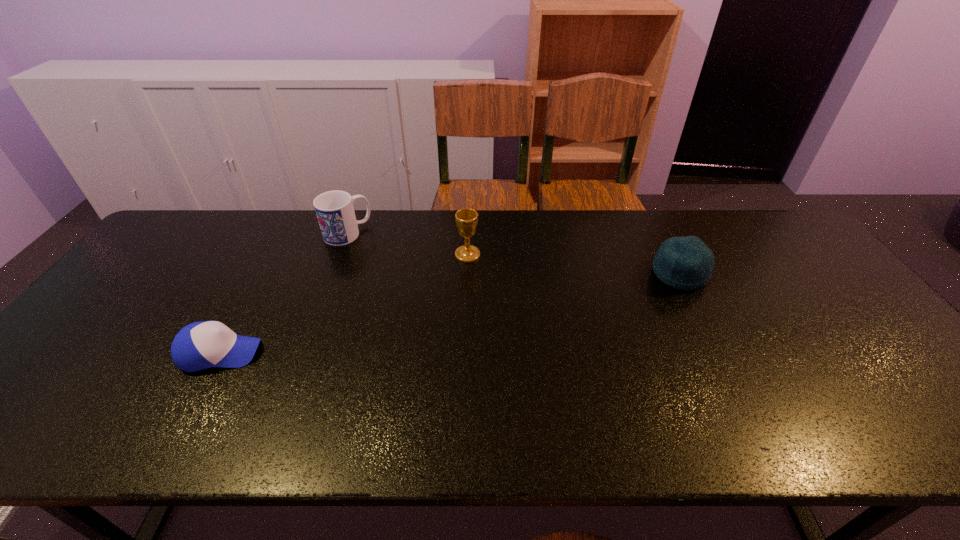
At what (x,y) coordinates should I click in order to perform the action: click on chalice located in the far edge section of the desktop. Please return your answer as a coordinate pair (x, y). This screenshot has width=960, height=540. Looking at the image, I should click on (466, 219).

Identify the location of mug positioned at the far edge. click(x=334, y=209).

Find the location of a particular element. The image size is (960, 540). vacant space at the far edge of the desktop is located at coordinates (223, 246).

Identify the location of vacant space at the near edge of the desktop. (622, 420).

Identify the location of vacant space at the left edge of the desktop. (94, 366).

The image size is (960, 540). In order to click on vacant space at the right edge of the desktop in this screenshot , I will do `click(791, 291)`.

You are a GUI agent. You are given a task and a screenshot of the screen. Output one action in this format:
    pyautogui.click(x=<x>, y=<y>)
    Task: Click on the vacant space at the far right corner of the desktop
    This screenshot has height=540, width=960.
    Given the screenshot: What is the action you would take?
    pyautogui.click(x=776, y=227)

This screenshot has height=540, width=960. In order to click on empty space between the second object from right to left and the rightmost object in this screenshot , I will do `click(573, 264)`.

Locate an element on the screen. This screenshot has height=540, width=960. free space between the beanie and the mug is located at coordinates (514, 253).

I want to click on vacant space that's between the second object from left to right and the third object from left to right, so click(x=407, y=244).